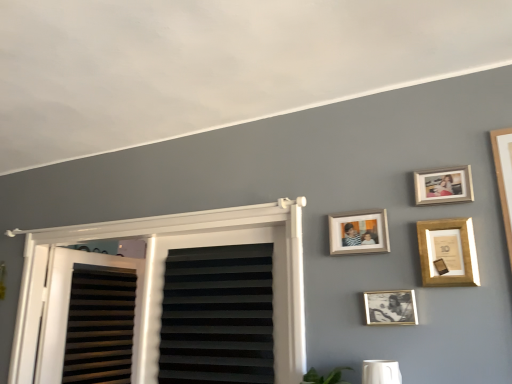
Question: Considering the relative sizes of black/gold photo frame at center, the first picture frame positioned from the bottom, and wooden photo frame at upper right, the fourth picture frame positioned from the bottom, in the image provided, is black/gold photo frame at center, the first picture frame positioned from the bottom, shorter than wooden photo frame at upper right, the fourth picture frame positioned from the bottom,?

Choices:
 (A) no
 (B) yes

Answer: (B)

Question: Is there a large distance between black/gold photo frame at center, the first picture frame positioned from the bottom, and wooden photo frame at upper right, the fourth picture frame positioned from the bottom?

Choices:
 (A) yes
 (B) no

Answer: (B)

Question: Does black/gold photo frame at center, the fourth picture frame in the top-to-bottom sequence, come in front of wooden photo frame at upper right, the fourth picture frame positioned from the bottom?

Choices:
 (A) no
 (B) yes

Answer: (B)

Question: Is black/gold photo frame at center, the fourth picture frame in the top-to-bottom sequence, completely or partially outside of wooden photo frame at upper right, the fourth picture frame positioned from the bottom?

Choices:
 (A) no
 (B) yes

Answer: (B)

Question: From the image's perspective, is black/gold photo frame at center, the first picture frame positioned from the bottom, beneath wooden photo frame at upper right, the fourth picture frame positioned from the bottom?

Choices:
 (A) no
 (B) yes

Answer: (B)

Question: Looking at their shapes, would you say black/gold photo frame at center, the first picture frame positioned from the bottom, is wider or thinner than wooden photo frame at upper center, the 3th picture frame in the bottom-to-top sequence?

Choices:
 (A) wide
 (B) thin

Answer: (B)

Question: Would you say black/gold photo frame at center, the fourth picture frame in the top-to-bottom sequence, is inside or outside wooden photo frame at upper center, the 2th picture frame from the top?

Choices:
 (A) inside
 (B) outside

Answer: (B)

Question: From a real-world perspective, is black/gold photo frame at center, the first picture frame positioned from the bottom, positioned above or below wooden photo frame at upper center, the 3th picture frame in the bottom-to-top sequence?

Choices:
 (A) above
 (B) below

Answer: (B)

Question: Relative to wooden photo frame at upper center, the 3th picture frame in the bottom-to-top sequence, is black/gold photo frame at center, the fourth picture frame in the top-to-bottom sequence, in front or behind?

Choices:
 (A) behind
 (B) front

Answer: (B)

Question: From a real-world perspective, relative to black/gold photo frame at center, the first picture frame positioned from the bottom, is wooden picture frame at upper right, the third picture frame from the top, vertically above or below?

Choices:
 (A) below
 (B) above

Answer: (B)

Question: Based on their sizes in the image, would you say wooden picture frame at upper right, which is counted as the 2th picture frame, starting from the bottom, is bigger or smaller than black/gold photo frame at center, the fourth picture frame in the top-to-bottom sequence?

Choices:
 (A) big
 (B) small

Answer: (A)

Question: Relative to black/gold photo frame at center, the first picture frame positioned from the bottom, is wooden picture frame at upper right, which is counted as the 2th picture frame, starting from the bottom, in front or behind?

Choices:
 (A) front
 (B) behind

Answer: (A)

Question: Looking at their shapes, would you say wooden picture frame at upper right, which is counted as the 2th picture frame, starting from the bottom, is wider or thinner than black/gold photo frame at center, the fourth picture frame in the top-to-bottom sequence?

Choices:
 (A) thin
 (B) wide

Answer: (B)

Question: Does point (357, 231) appear closer or farther from the camera than point (466, 165)?

Choices:
 (A) farther
 (B) closer

Answer: (A)

Question: Considering their positions, is wooden photo frame at upper center, the 2th picture frame from the top, located in front of or behind wooden photo frame at upper right, the fourth picture frame positioned from the bottom?

Choices:
 (A) behind
 (B) front

Answer: (A)